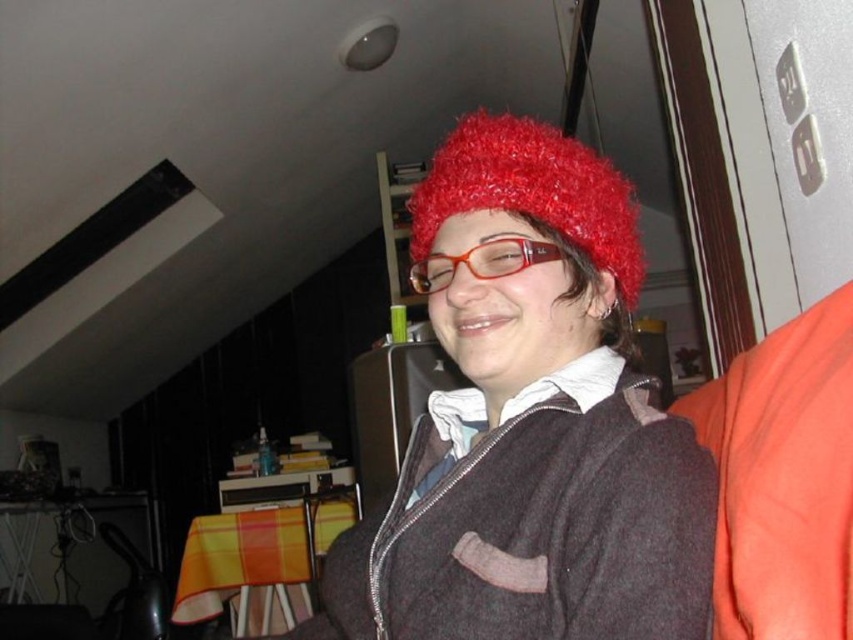
Question: Which point is farther to the camera?

Choices:
 (A) (634, 282)
 (B) (460, 579)

Answer: (A)

Question: Which of the following is the farthest from the observer?

Choices:
 (A) fuzzy red hat at center
 (B) fluffy red hat at upper center

Answer: (B)

Question: Does fuzzy red hat at center appear over fluffy red hat at upper center?

Choices:
 (A) yes
 (B) no

Answer: (B)

Question: Among these points, which one is nearest to the camera?

Choices:
 (A) (506, 504)
 (B) (431, 166)

Answer: (A)

Question: Where is fuzzy red hat at center located in relation to fluffy red hat at upper center in the image?

Choices:
 (A) left
 (B) right

Answer: (A)

Question: Is fuzzy red hat at center to the left of fluffy red hat at upper center from the viewer's perspective?

Choices:
 (A) no
 (B) yes

Answer: (B)